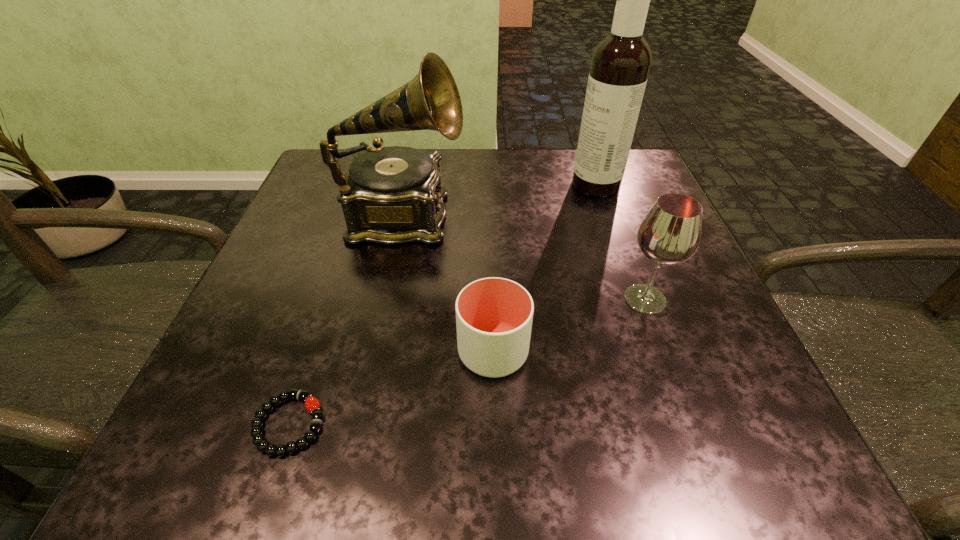
Identify the location of vacant region located 0.090m on the label side of the dishwasher detergent. The image size is (960, 540). (532, 185).

Locate an element on the screen. The width and height of the screenshot is (960, 540). vacant point located 0.270m on the horn of the phonograph record is located at coordinates (598, 219).

Find the location of a particular element. This screenshot has width=960, height=540. blank space located on the back of the wineglass is located at coordinates (625, 244).

Find the location of a particular element. Image resolution: width=960 pixels, height=540 pixels. vacant space situated on the back of the cup is located at coordinates (490, 215).

I want to click on free location located on the back of the bracelet, so click(328, 307).

The height and width of the screenshot is (540, 960). I want to click on dishwasher detergent at the far edge, so click(x=620, y=65).

Identify the location of phonograph record that is at the far edge. click(391, 195).

The image size is (960, 540). In order to click on object that is at the near edge in this screenshot , I will do `click(312, 404)`.

You are a GUI agent. You are given a task and a screenshot of the screen. Output one action in this format:
    pyautogui.click(x=<x>, y=<y>)
    Task: Click on the phonograph record that is at the left edge
    The image size is (960, 540).
    Given the screenshot: What is the action you would take?
    pyautogui.click(x=391, y=195)

At what (x,y) coordinates should I click in order to perform the action: click on bracelet that is at the left edge. Please return your answer as a coordinate pair (x, y). The height and width of the screenshot is (540, 960). Looking at the image, I should click on (312, 404).